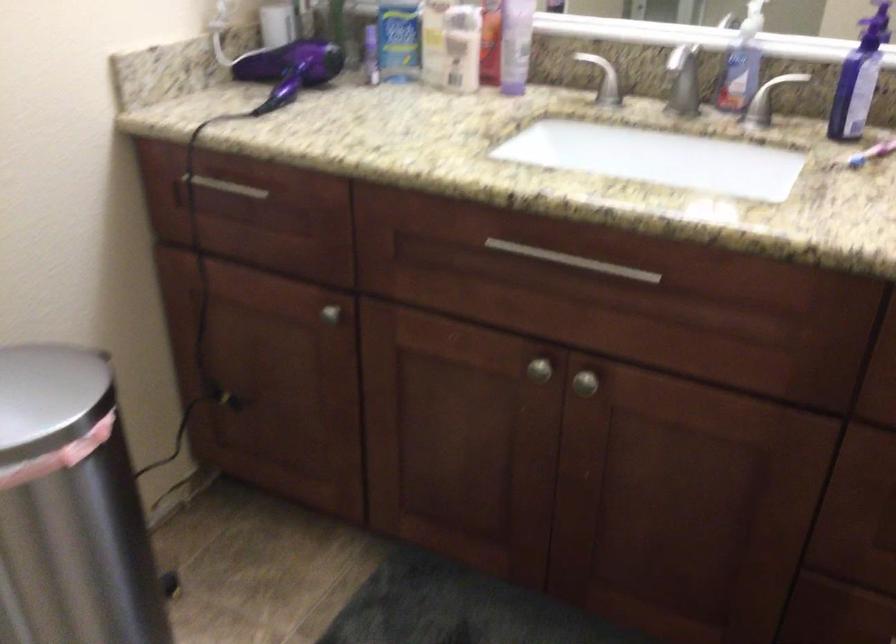
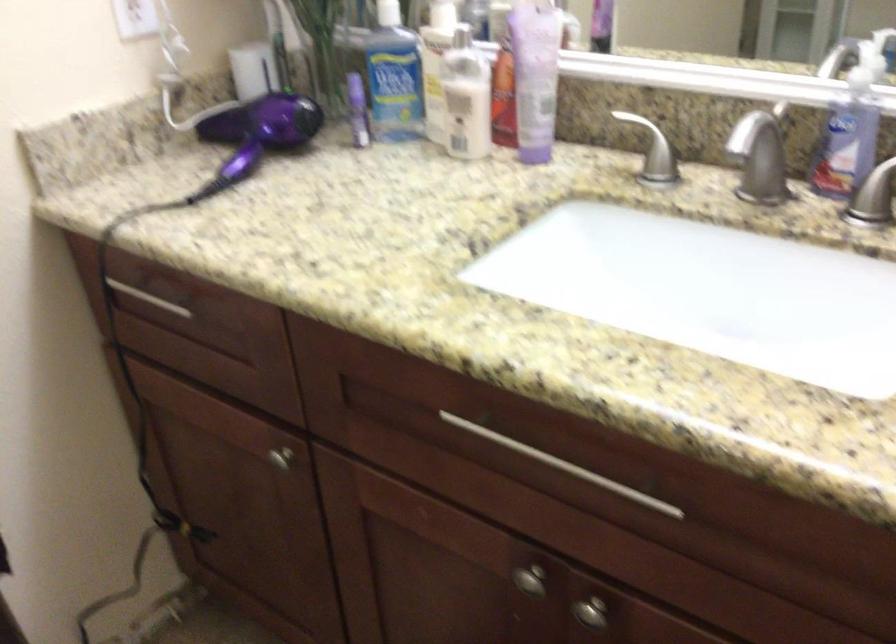
Where in the second image is the point corresponding to (x=606, y=84) from the first image?

(651, 149)